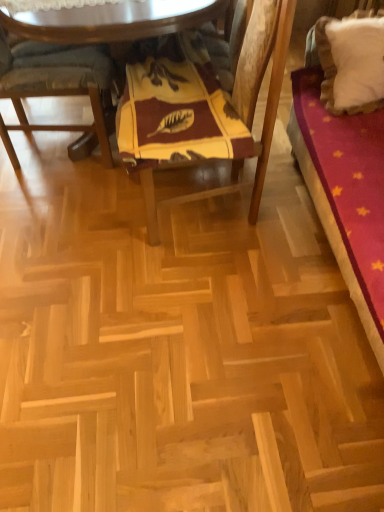
Question: Looking at the image, does natural wood parquet floor at center seem bigger or smaller compared to white fluffy pillow at upper right?

Choices:
 (A) big
 (B) small

Answer: (A)

Question: Considering their positions, is natural wood parquet floor at center located in front of or behind white fluffy pillow at upper right?

Choices:
 (A) front
 (B) behind

Answer: (A)

Question: Which object is positioned farthest from the white fluffy pillow at upper right?

Choices:
 (A) wooden table at center
 (B) wooden cushioned chair at left, the 1th chair positioned from the left
 (C) yellowvelvet-like fabricblanket at center
 (D) natural wood parquet floor at center
 (E) yellow fabric cushion at center, acting as the 1th chair starting from the right

Answer: (B)

Question: Which of these objects is positioned closest to the yellow fabric cushion at center, acting as the 1th chair starting from the right?

Choices:
 (A) natural wood parquet floor at center
 (B) yellowvelvet-like fabricblanket at center
 (C) wooden table at center
 (D) wooden cushioned chair at left, the 1th chair positioned from the left
 (E) white fluffy pillow at upper right

Answer: (B)